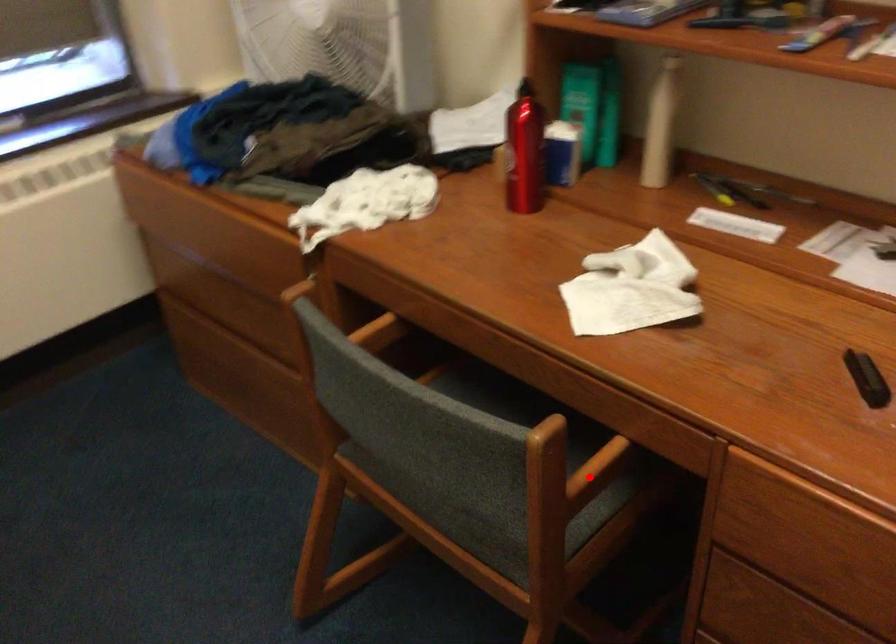
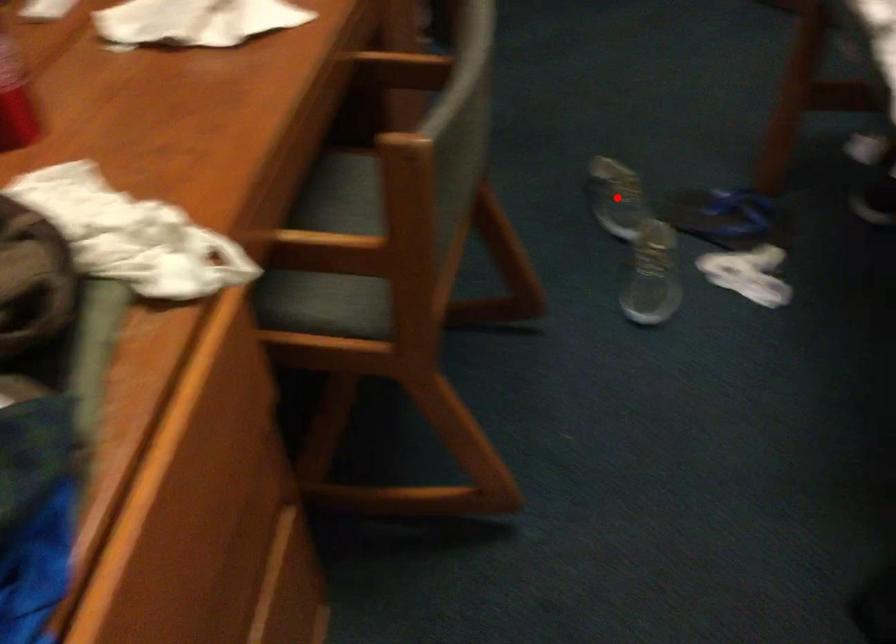
I am providing you with two images of the same scene from different viewpoints. A red point is marked on the first image and another point is marked on the second image. Is the marked point in image1 the same physical position as the marked point in image2?

No